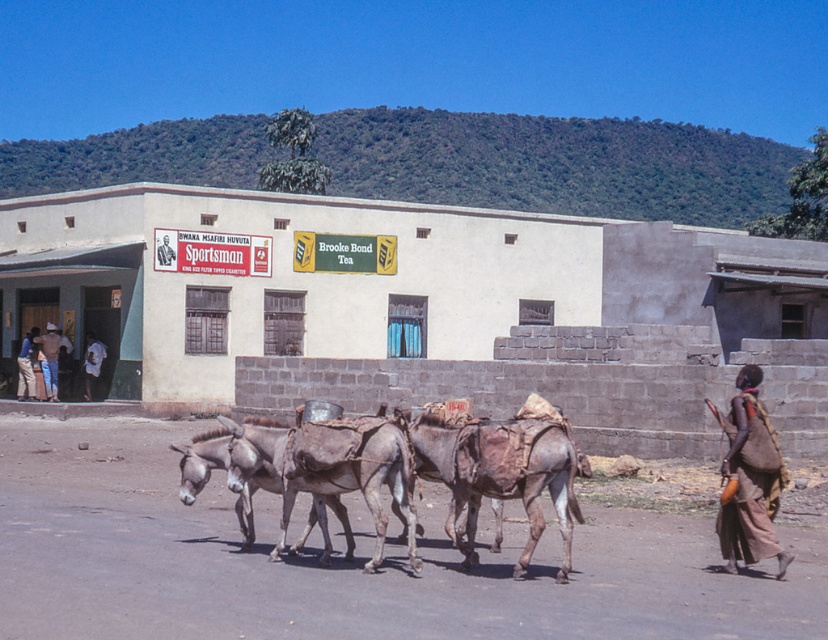
Question: Is gray rough skin donkey at center above white cotton shirt at left?

Choices:
 (A) yes
 (B) no

Answer: (B)

Question: Is brown leather mule at center above light brown leather jacket at left?

Choices:
 (A) yes
 (B) no

Answer: (B)

Question: Is brown leather mule at center behind gray textured donkey at center?

Choices:
 (A) no
 (B) yes

Answer: (A)

Question: Among these points, which one is nearest to the camera?

Choices:
 (A) (326, 502)
 (B) (384, 442)

Answer: (B)

Question: Which of these objects is positioned farthest from the brown woven cloth at lower right?

Choices:
 (A) brown leather mule at center
 (B) light brown leather jacket at left

Answer: (B)

Question: Which point appears closest to the camera in this image?

Choices:
 (A) (18, 397)
 (B) (53, 378)

Answer: (B)